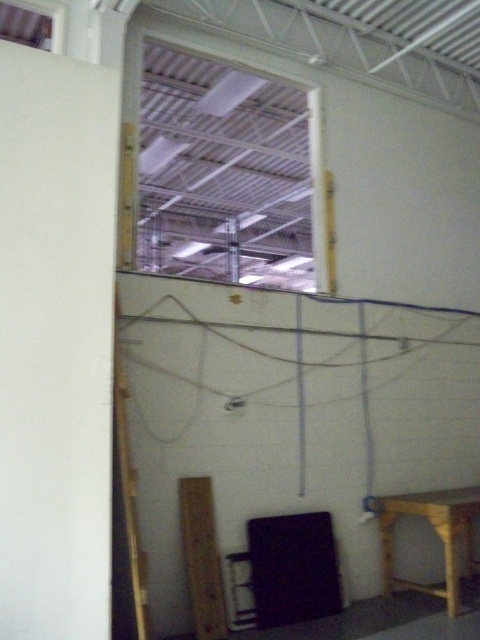
Can you confirm if wooden at left is smaller than black plastic stool at lower center?

No.

Where is `wooden at left`? wooden at left is located at coordinates (130, 508).

In order to click on wooden stool at lower right in this screenshot , I will do `click(435, 532)`.

Looking at this image, can you confirm if wooden stool at lower right is bigger than black plastic stool at lower center?

Yes.

Between point (451, 500) and point (236, 595), which one is positioned behind?

The point (451, 500) is more distant.

Find the location of a particular element. Image resolution: width=480 pixels, height=640 pixels. wooden stool at lower right is located at coordinates (435, 532).

Is wooden stool at lower right further to camera compared to wooden at left?

Yes, wooden stool at lower right is behind wooden at left.

Find the location of a particular element. wooden stool at lower right is located at coordinates (435, 532).

This screenshot has height=640, width=480. Describe the element at coordinates (435, 532) in the screenshot. I see `wooden stool at lower right` at that location.

Where is `wooden stool at lower right`? wooden stool at lower right is located at coordinates click(435, 532).